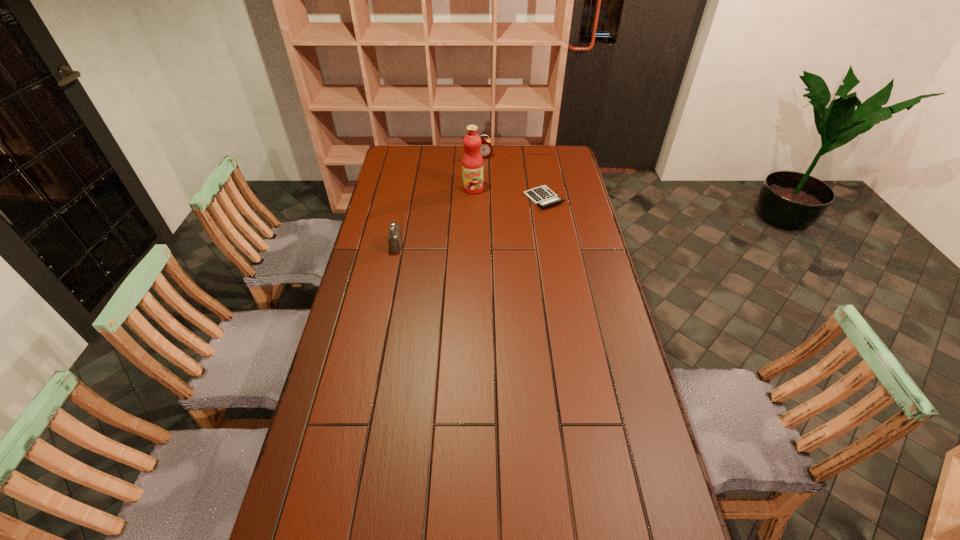
In the image, there is a desktop. Where is `vacant space at the near edge`? The width and height of the screenshot is (960, 540). vacant space at the near edge is located at coordinates (575, 532).

You are a GUI agent. You are given a task and a screenshot of the screen. Output one action in this format:
    pyautogui.click(x=<x>, y=<y>)
    Task: Click on the vacant area at the left edge
    
    Given the screenshot: What is the action you would take?
    pyautogui.click(x=373, y=320)

Locate an element on the screen. This screenshot has width=960, height=540. blank space at the right edge is located at coordinates (564, 231).

Find the location of a particular element. This screenshot has height=540, width=960. vacant space at the far left corner is located at coordinates (414, 158).

This screenshot has width=960, height=540. In the image, there is a desktop. What are the coordinates of `vacant space at the near left corner` in the screenshot? It's located at (299, 507).

What are the coordinates of `free spot at the far right corner of the desktop` in the screenshot? It's located at (553, 156).

Where is `free point between the leftmost object and the tallest object`? free point between the leftmost object and the tallest object is located at coordinates (435, 218).

The height and width of the screenshot is (540, 960). What are the coordinates of `empty location between the leftmost object and the farthest object` in the screenshot? It's located at (440, 201).

Where is `vacant area between the fruit juice and the nearest object`? The width and height of the screenshot is (960, 540). vacant area between the fruit juice and the nearest object is located at coordinates (435, 218).

You are a GUI agent. You are given a task and a screenshot of the screen. Output one action in this format:
    pyautogui.click(x=<x>, y=<y>)
    Task: Click on the free spot between the alarm clock and the padlock
    
    Given the screenshot: What is the action you would take?
    pyautogui.click(x=440, y=201)